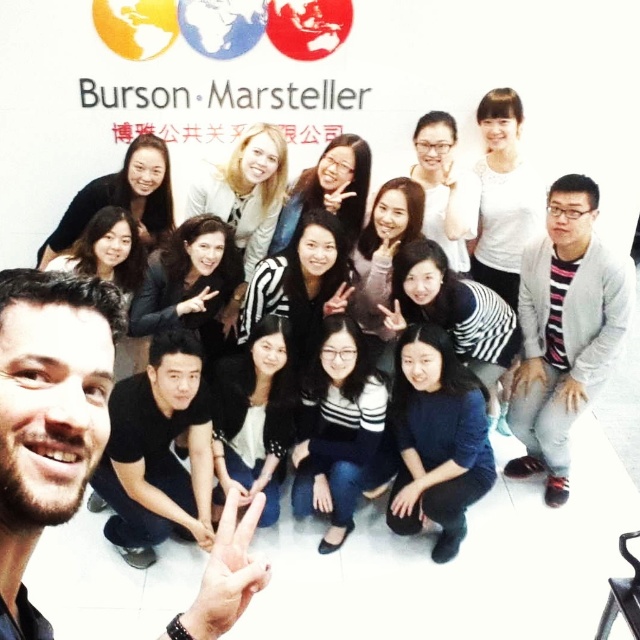
Question: Estimate the real-world distances between objects in this image. Which object is closer to the white matte shirt at upper right?

Choices:
 (A) matte black jacket at upper left
 (B) gray striped sweater at lower right
 (C) white matte sweater at upper center
 (D) matte black hair at center

Answer: (C)

Question: Which is nearer to the gray striped sweater at lower right?

Choices:
 (A) white matte sweater at upper center
 (B) matte black jacket at upper left
 (C) matte black hair at center

Answer: (A)

Question: Is gray striped sweater at lower right wider than matte black jacket at upper left?

Choices:
 (A) yes
 (B) no

Answer: (B)

Question: Which point is farther from the camera taking this photo?

Choices:
 (A) (506, 262)
 (B) (67, 220)

Answer: (A)

Question: Is white matte shirt at upper right above matte black hair at center?

Choices:
 (A) no
 (B) yes

Answer: (B)

Question: From the image, what is the correct spatial relationship of gray striped sweater at lower right in relation to white matte sweater at upper center?

Choices:
 (A) above
 (B) below

Answer: (B)